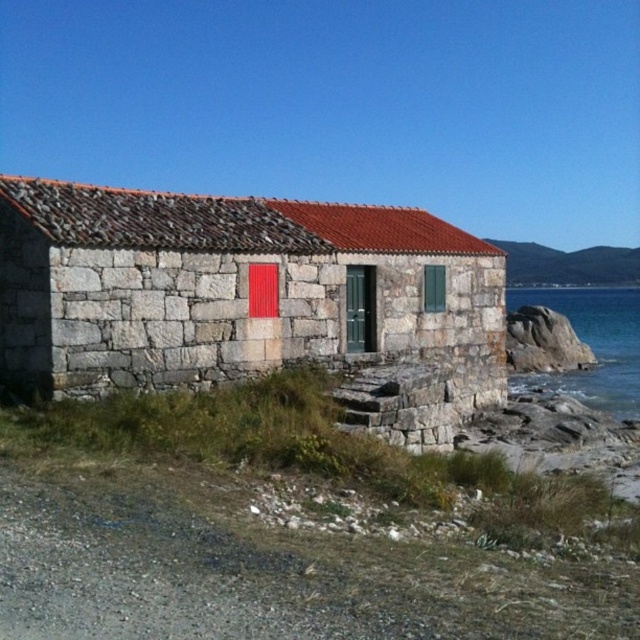
You are planning to build a small garden between the stone textured hut at center and the blue water at lower right. Considering their sizes, which area would be more suitable for placing the garden?

The stone textured hut at center has a smaller size compared to blue water at lower right, so the garden would be more suitable near the stone textured hut at center where there is more available space.